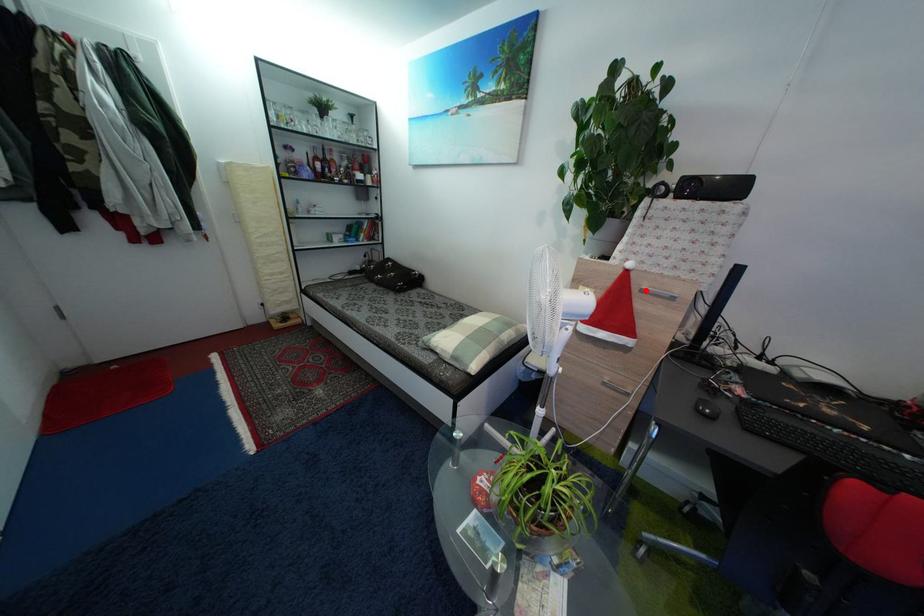
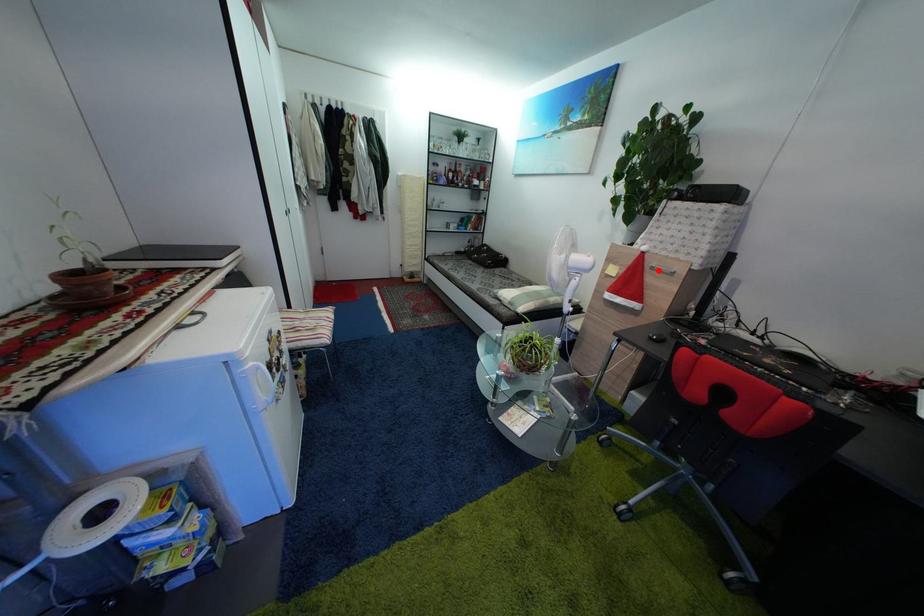
I am providing you with two images of the same scene from different viewpoints. A red point is marked on the first image and another point is marked on the second image. Is the marked point in image1 the same physical position as the marked point in image2?

Yes